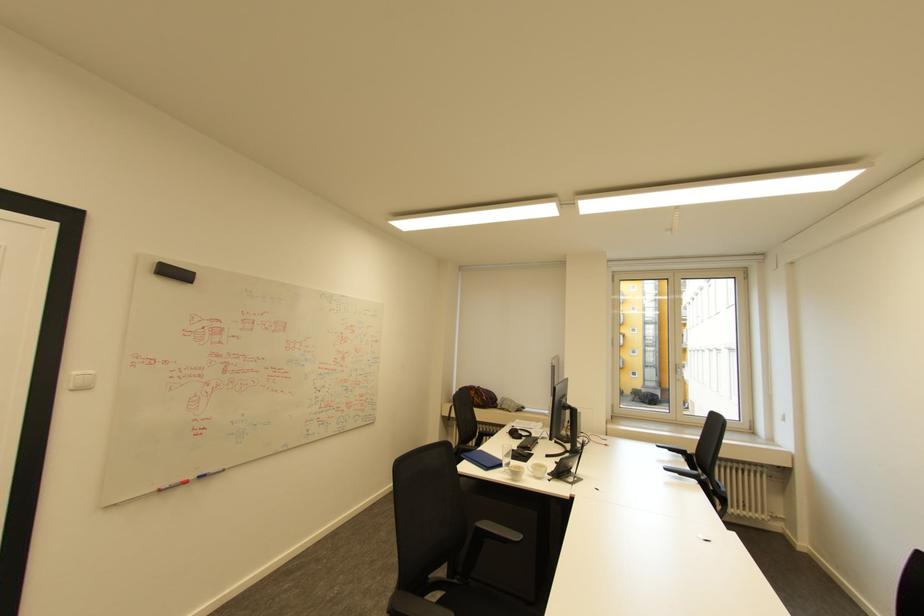
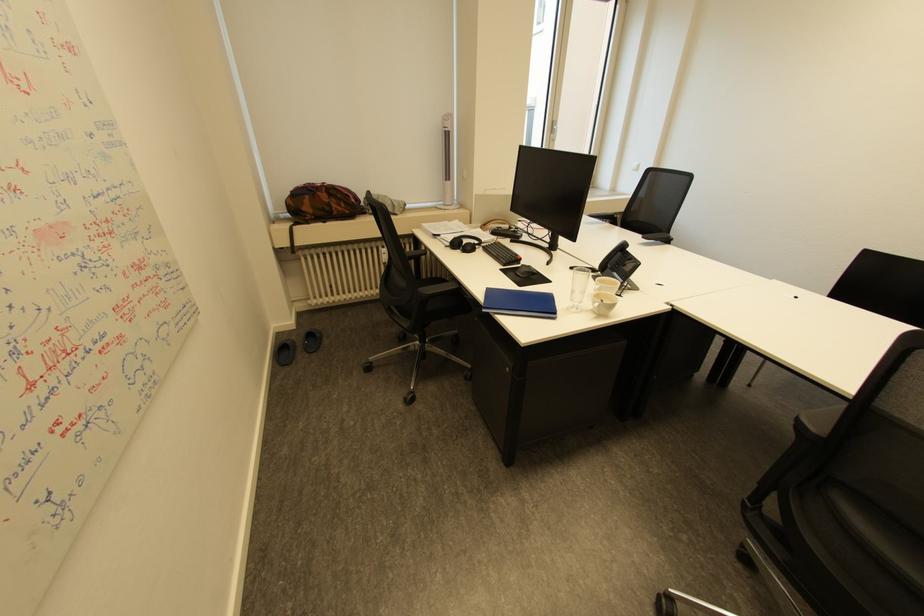
Find the pixel in the second image that matches [468,455] in the first image.

(491, 310)